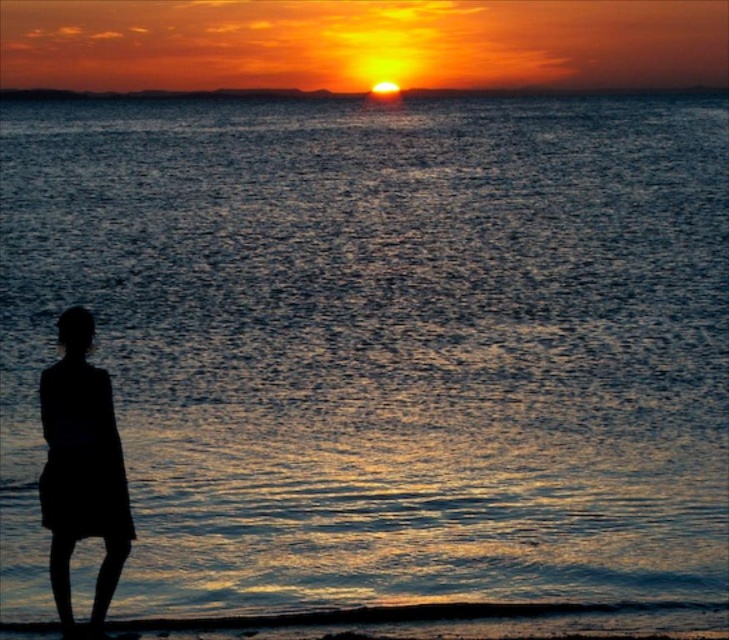
Looking at this image, you are a photographer trying to capture the sunset scene. You notice the silhouette dress at left and the smooth orange sky at center. Which object is positioned lower in the image?

The silhouette dress at left is positioned lower than the smooth orange sky at center.